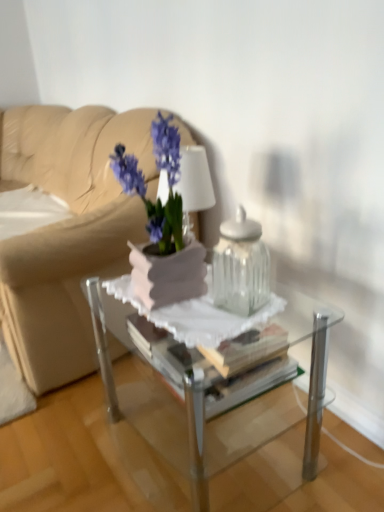
What are the coordinates of `free space above clear glass table at center (from a real-world perspective)` in the screenshot? It's located at (205, 307).